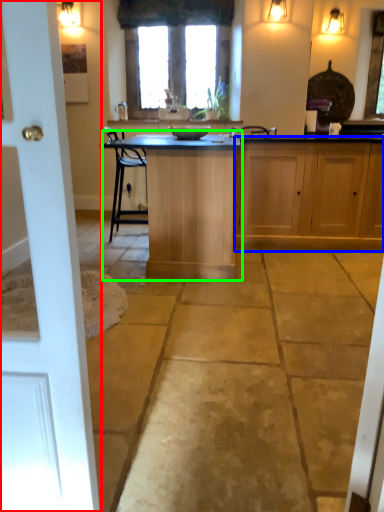
Question: Considering the real-world distances, which object is closest to door (highlighted by a red box)? cabinetry (highlighted by a blue box) or table (highlighted by a green box).

Choices:
 (A) cabinetry
 (B) table

Answer: (B)